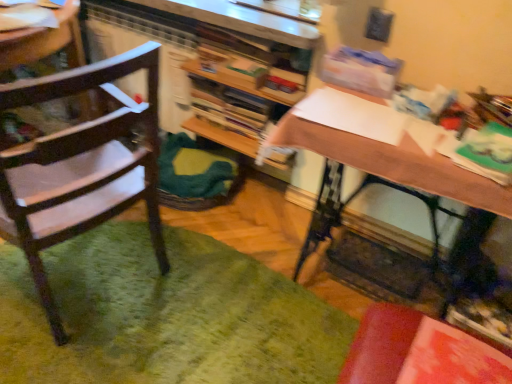
Question: From the image's perspective, is green fuzzy mat at lower left beneath wooden desk at center?

Choices:
 (A) yes
 (B) no

Answer: (A)

Question: Are green fuzzy mat at lower left and wooden desk at center far apart?

Choices:
 (A) yes
 (B) no

Answer: (B)

Question: Considering the relative sizes of green fuzzy mat at lower left and wooden desk at center in the image provided, is green fuzzy mat at lower left shorter than wooden desk at center?

Choices:
 (A) yes
 (B) no

Answer: (A)

Question: Is green fuzzy mat at lower left wider than wooden desk at center?

Choices:
 (A) no
 (B) yes

Answer: (B)

Question: Does green fuzzy mat at lower left appear on the left side of wooden desk at center?

Choices:
 (A) no
 (B) yes

Answer: (B)

Question: In terms of height, does wooden chair at left look taller or shorter compared to green fuzzy mat at lower left?

Choices:
 (A) short
 (B) tall

Answer: (B)

Question: In the image, is wooden chair at left positioned in front of or behind green fuzzy mat at lower left?

Choices:
 (A) front
 (B) behind

Answer: (A)

Question: Considering the positions of wooden chair at left and green fuzzy mat at lower left in the image, is wooden chair at left bigger or smaller than green fuzzy mat at lower left?

Choices:
 (A) big
 (B) small

Answer: (A)

Question: Is wooden chair at left spatially inside green fuzzy mat at lower left, or outside of it?

Choices:
 (A) inside
 (B) outside

Answer: (B)

Question: From their relative heights in the image, would you say wooden desk at center is taller or shorter than wooden bookshelf at center?

Choices:
 (A) short
 (B) tall

Answer: (B)

Question: Is wooden desk at center situated inside wooden bookshelf at center or outside?

Choices:
 (A) outside
 (B) inside

Answer: (A)

Question: From a real-world perspective, is wooden desk at center above or below wooden bookshelf at center?

Choices:
 (A) above
 (B) below

Answer: (B)

Question: Based on their positions, is wooden desk at center located to the left or right of wooden bookshelf at center?

Choices:
 (A) right
 (B) left

Answer: (A)

Question: Considering their positions, is green fuzzy mat at lower left located in front of or behind wooden chair at left?

Choices:
 (A) front
 (B) behind

Answer: (B)

Question: Considering the positions of green fuzzy mat at lower left and wooden chair at left in the image, is green fuzzy mat at lower left bigger or smaller than wooden chair at left?

Choices:
 (A) small
 (B) big

Answer: (A)